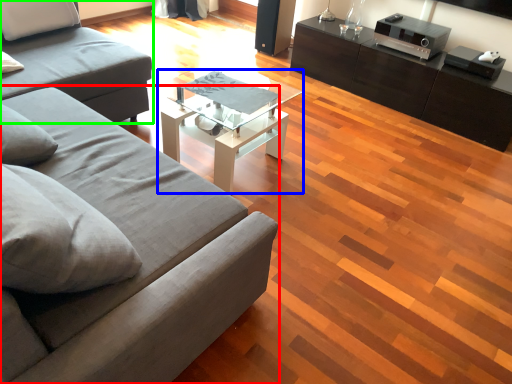
Question: Estimate the real-world distances between objects in this image. Which object is farther from studio couch (highlighted by a red box), coffee table (highlighted by a blue box) or studio couch (highlighted by a green box)?

Choices:
 (A) coffee table
 (B) studio couch

Answer: (B)